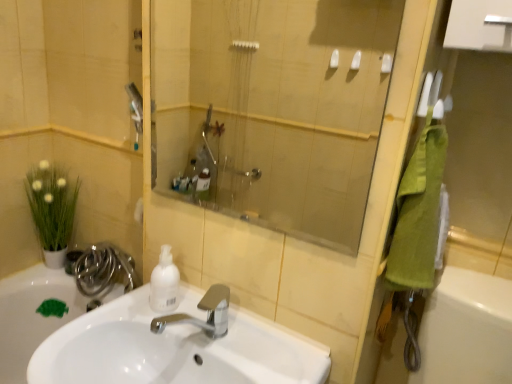
Question: Does white glossy sink at center have a lesser height compared to green towel at right?

Choices:
 (A) yes
 (B) no

Answer: (B)

Question: Is white glossy sink at center behind green towel at right?

Choices:
 (A) no
 (B) yes

Answer: (A)

Question: Does white glossy sink at center have a greater width compared to green towel at right?

Choices:
 (A) yes
 (B) no

Answer: (A)

Question: Does white glossy sink at center have a larger size compared to green towel at right?

Choices:
 (A) yes
 (B) no

Answer: (A)

Question: Is white glossy sink at center oriented towards green towel at right?

Choices:
 (A) yes
 (B) no

Answer: (B)

Question: Is green matte plant at left in front of or behind transparent glass shower at center in the image?

Choices:
 (A) front
 (B) behind

Answer: (B)

Question: From a real-world perspective, is green matte plant at left positioned above or below transparent glass shower at center?

Choices:
 (A) below
 (B) above

Answer: (A)

Question: From the image's perspective, relative to transparent glass shower at center, is green matte plant at left above or below?

Choices:
 (A) above
 (B) below

Answer: (B)

Question: In terms of height, does green matte plant at left look taller or shorter compared to transparent glass shower at center?

Choices:
 (A) tall
 (B) short

Answer: (B)

Question: In the image, is polished chrome hose at lower left positioned in front of or behind green matte soap dispenser at lower left?

Choices:
 (A) behind
 (B) front

Answer: (A)

Question: Considering the positions of polished chrome hose at lower left and green matte soap dispenser at lower left in the image, is polished chrome hose at lower left taller or shorter than green matte soap dispenser at lower left?

Choices:
 (A) short
 (B) tall

Answer: (A)

Question: Is polished chrome hose at lower left inside or outside of green matte soap dispenser at lower left?

Choices:
 (A) inside
 (B) outside

Answer: (B)

Question: From a real-world perspective, is polished chrome hose at lower left positioned above or below green matte soap dispenser at lower left?

Choices:
 (A) above
 (B) below

Answer: (A)

Question: Is polished chrome hose at lower left to the left or to the right of white glossy sink at center in the image?

Choices:
 (A) right
 (B) left

Answer: (B)

Question: Choose the correct answer: Is polished chrome hose at lower left inside white glossy sink at center or outside it?

Choices:
 (A) outside
 (B) inside

Answer: (A)